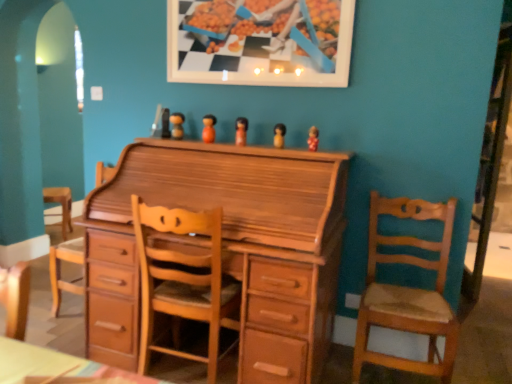
Question: Is light brown wood swivel chair at center in contact with wooden chair at center, which is the 2th chair in right-to-left order?

Choices:
 (A) no
 (B) yes

Answer: (A)

Question: Is light brown wood swivel chair at center positioned far away from wooden chair at center, acting as the 1th chair starting from the left?

Choices:
 (A) no
 (B) yes

Answer: (A)

Question: Is light brown wood swivel chair at center taller than wooden chair at center, which is the 2th chair in right-to-left order?

Choices:
 (A) no
 (B) yes

Answer: (B)

Question: Is light brown wood swivel chair at center closer to the viewer compared to wooden chair at center, which is the 2th chair in right-to-left order?

Choices:
 (A) no
 (B) yes

Answer: (A)

Question: From the image's perspective, does light brown wood swivel chair at center appear lower than wooden chair at center, acting as the 1th chair starting from the left?

Choices:
 (A) no
 (B) yes

Answer: (A)

Question: Is light brown wood swivel chair at center positioned with its back to wooden chair at center, which is the 2th chair in right-to-left order?

Choices:
 (A) yes
 (B) no

Answer: (B)

Question: Is wooden picture frame at upper center to the left of matte wooden figurine at center, which is the fifth toy from left to right, from the viewer's perspective?

Choices:
 (A) yes
 (B) no

Answer: (A)

Question: Is the surface of wooden picture frame at upper center in direct contact with matte wooden figurine at center, which is the fifth toy from left to right?

Choices:
 (A) no
 (B) yes

Answer: (A)

Question: Considering the relative positions of wooden picture frame at upper center and matte wooden figurine at center, which is the fifth toy from left to right, in the image provided, is wooden picture frame at upper center to the right of matte wooden figurine at center, which is the fifth toy from left to right, from the viewer's perspective?

Choices:
 (A) no
 (B) yes

Answer: (A)

Question: Would you say wooden picture frame at upper center is a long distance from matte wooden figurine at center, which is the fifth toy from left to right?

Choices:
 (A) yes
 (B) no

Answer: (B)

Question: Does wooden picture frame at upper center turn towards matte wooden figurine at center, marked as the 1th toy in a right-to-left arrangement?

Choices:
 (A) no
 (B) yes

Answer: (A)

Question: From the image's perspective, would you say wooden picture frame at upper center is shown under matte wooden figurine at center, which is the fifth toy from left to right?

Choices:
 (A) yes
 (B) no

Answer: (B)

Question: Is the surface of light brown wooden chair at right, the second chair viewed from the left, in direct contact with matte wooden figurine at center, marked as the 1th toy in a right-to-left arrangement?

Choices:
 (A) no
 (B) yes

Answer: (A)